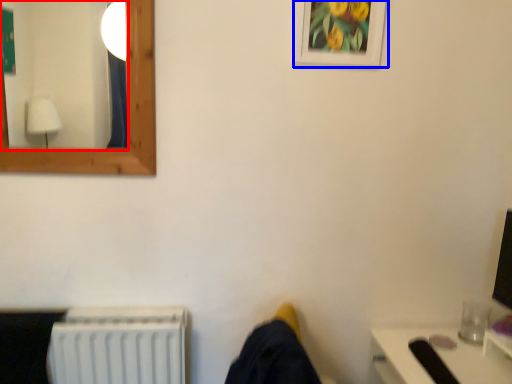
Question: Which object is further to the camera taking this photo, mirror (highlighted by a red box) or picture frame (highlighted by a blue box)?

Choices:
 (A) mirror
 (B) picture frame

Answer: (B)